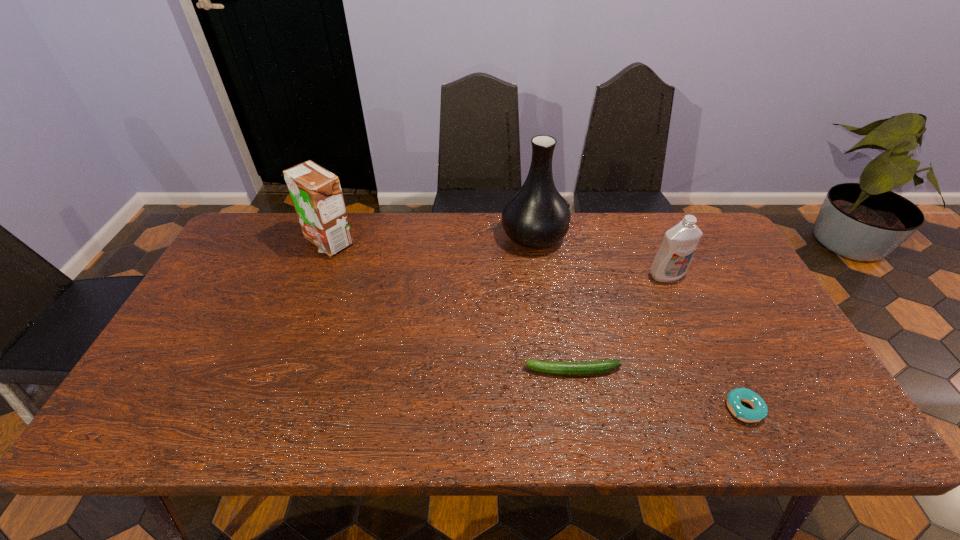
The image size is (960, 540). Identify the location of free region at the left edge of the desktop. pyautogui.click(x=217, y=368).

Locate an element on the screen. vacant space at the right edge of the desktop is located at coordinates (729, 287).

At what (x,y) coordinates should I click in order to perform the action: click on empty space between the zucchini and the vase. Please return your answer as a coordinate pair (x, y). Image resolution: width=960 pixels, height=540 pixels. Looking at the image, I should click on (554, 303).

Find the location of `vacant area between the tallest object and the leftmost object`. vacant area between the tallest object and the leftmost object is located at coordinates (431, 239).

You are a GUI agent. You are given a task and a screenshot of the screen. Output one action in this format:
    pyautogui.click(x=<x>, y=<y>)
    Task: Click on the free space between the vase and the fourth farthest object
    
    Given the screenshot: What is the action you would take?
    pyautogui.click(x=554, y=303)

Locate an element on the screen. vacant point located between the leftmost object and the doughnut is located at coordinates (537, 325).

Locate an element on the screen. vacant space in between the carton and the zucchini is located at coordinates (451, 306).

Find the location of a particular element. This screenshot has width=960, height=540. unoccupied area between the vase and the leftmost object is located at coordinates (431, 239).

Find the location of a particular element. This screenshot has height=540, width=960. free point between the zucchini and the third shortest object is located at coordinates (620, 323).

At what (x,y) coordinates should I click in order to perform the action: click on free space between the third nearest object and the carton. Please return your answer as a coordinate pair (x, y). The image size is (960, 540). Looking at the image, I should click on (498, 259).